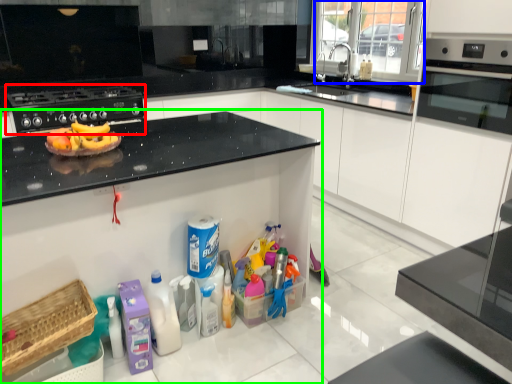
Question: Estimate the real-world distances between objects in this image. Which object is farther from kitchen appliance (highlighted by a red box), glass door (highlighted by a blue box) or countertop (highlighted by a green box)?

Choices:
 (A) glass door
 (B) countertop

Answer: (A)